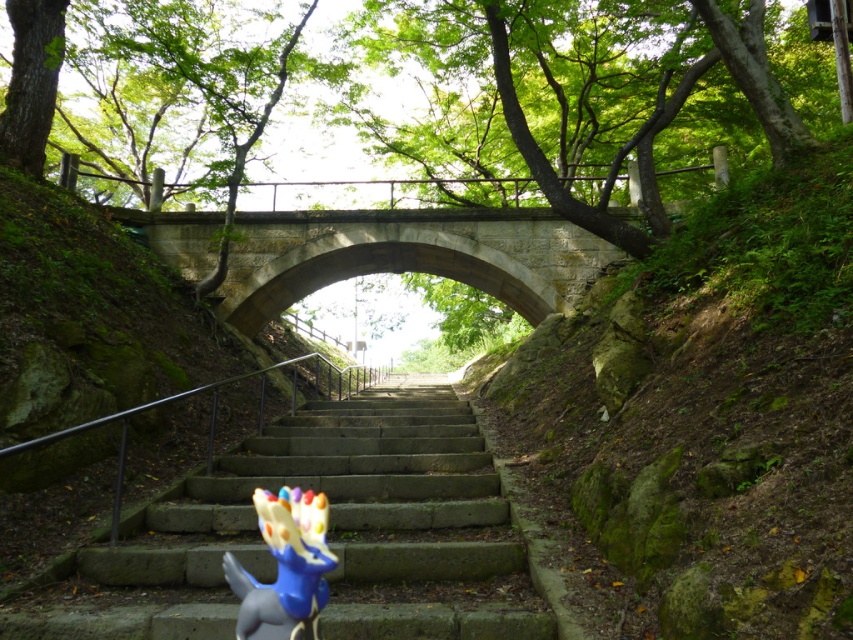
Question: Does stone stairs at center lie behind stone bridge at center?

Choices:
 (A) yes
 (B) no

Answer: (B)

Question: Estimate the real-world distances between objects in this image. Which object is farther from the stone stairs at center?

Choices:
 (A) stone bridge at center
 (B) blue rubber dinosaur at center

Answer: (A)

Question: Observing the image, what is the correct spatial positioning of green mossy rock at upper right in reference to blue rubber dinosaur at center?

Choices:
 (A) above
 (B) below

Answer: (A)

Question: Which object appears closest to the camera in this image?

Choices:
 (A) stone stairs at center
 (B) stone bridge at center
 (C) blue rubber dinosaur at center
 (D) green mossy rock at upper right

Answer: (C)

Question: Does green mossy rock at upper right have a greater width compared to blue rubber dinosaur at center?

Choices:
 (A) yes
 (B) no

Answer: (A)

Question: Which of the following is the farthest from the observer?

Choices:
 (A) stone bridge at center
 (B) blue rubber dinosaur at center

Answer: (A)